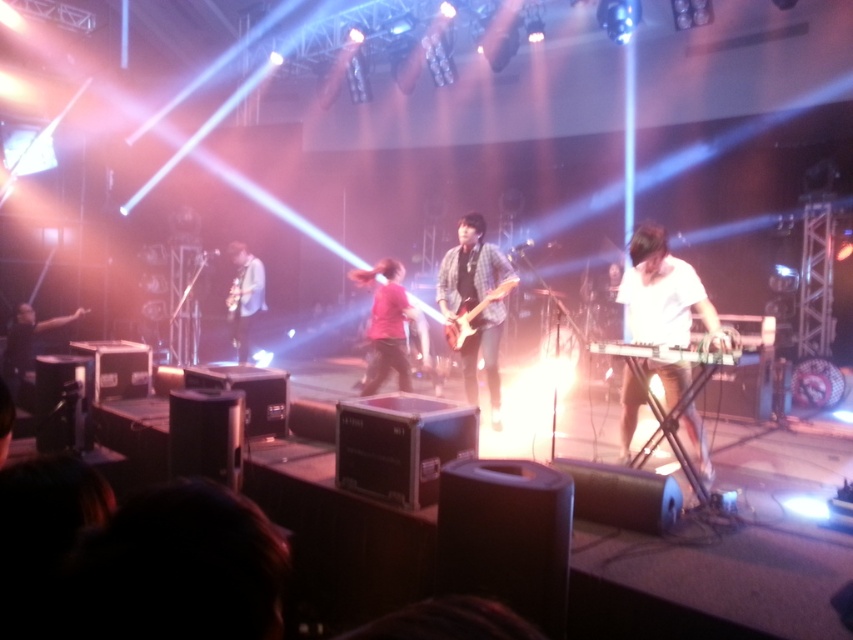
You are a stagehand setting up for a concert. You need to place a new microphone stand between the matte black guitar at center and the black drum at left. Based on their heights, which object should the stand be placed closer to?

The matte black guitar at center is taller than the black drum at left. Therefore, the microphone stand should be placed closer to the black drum at left to ensure it doesn not block the taller guitar.

You are a photographer at the back of the venue. You want to take a photo of the shiny black electric guitar at center without the matte red shirt at center blocking it. Is the guitar visible above the shirt?

The matte red shirt at center is much taller as shiny black electric guitar at center, so the guitar is not visible above the shirt. You might need to adjust your angle or move closer to avoid the obstruction.

You are a photographer at the back of the venue and want to capture a clear photo of the matte red shirt at center and the black drum at left. Which object will appear smaller in the photo?

The matte red shirt at center will appear smaller in the photo because it occupies less space than the black drum at left.